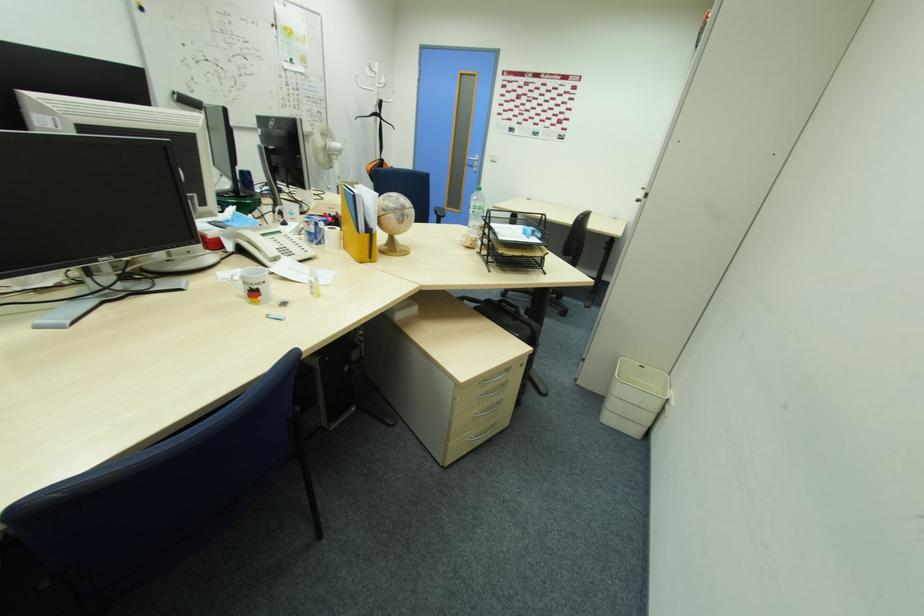
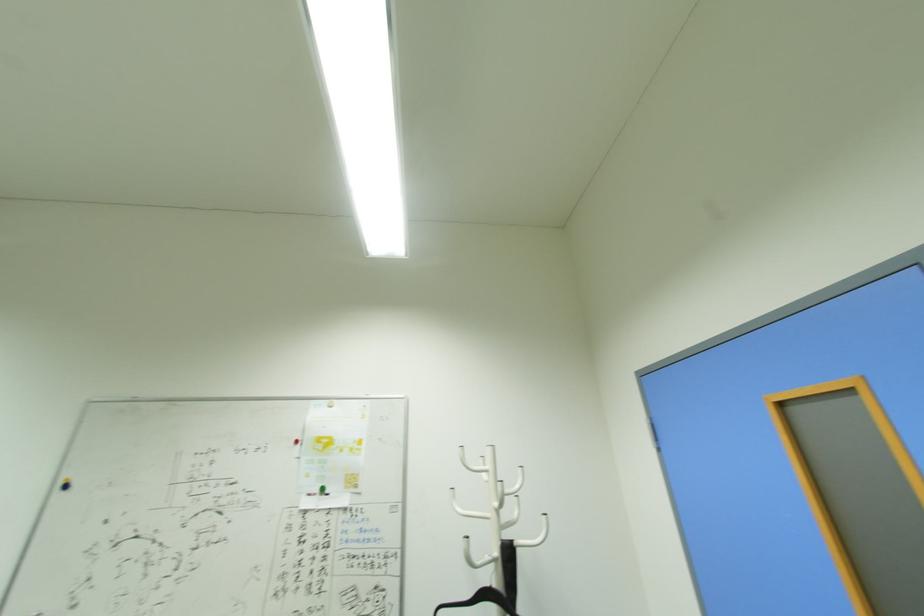
In the second image, find the point that corresponds to point (378, 79) in the first image.

(492, 484)